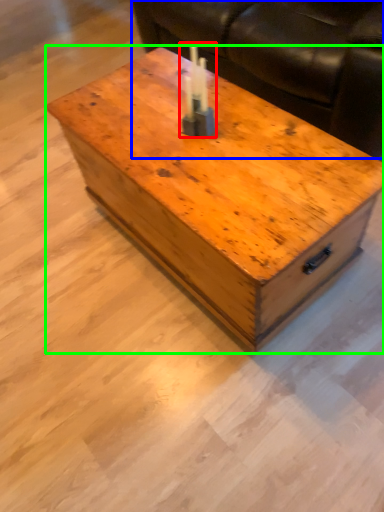
Question: Considering the real-world distances, which object is closest to birthday candle (highlighted by a red box)? couch (highlighted by a blue box) or coffee table (highlighted by a green box).

Choices:
 (A) couch
 (B) coffee table

Answer: (B)